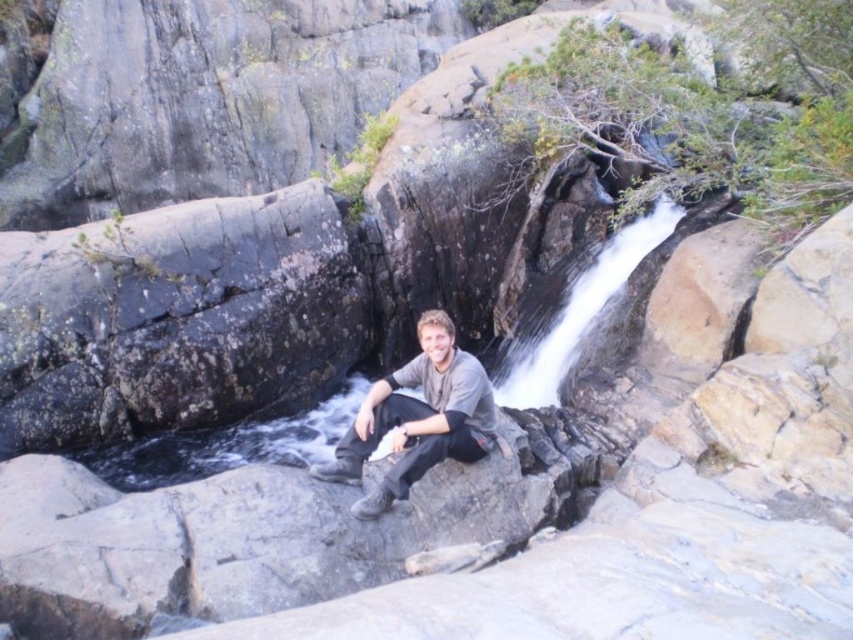
Consider the image. Between smooth rock creek at center and gray matte shirt at center, which one is positioned lower?

gray matte shirt at center is lower down.

Between point (653, 216) and point (439, 360), which one is positioned behind?

The point (653, 216) is behind.

Where is `smooth rock creek at center`? smooth rock creek at center is located at coordinates (570, 310).